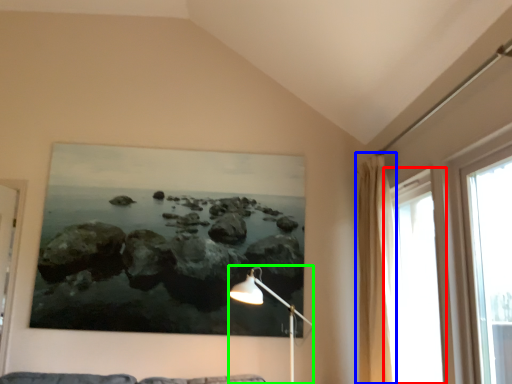
Question: Which is farther away from window (highlighted by a red box)? curtain (highlighted by a blue box) or table lamp (highlighted by a green box)?

Choices:
 (A) curtain
 (B) table lamp

Answer: (B)